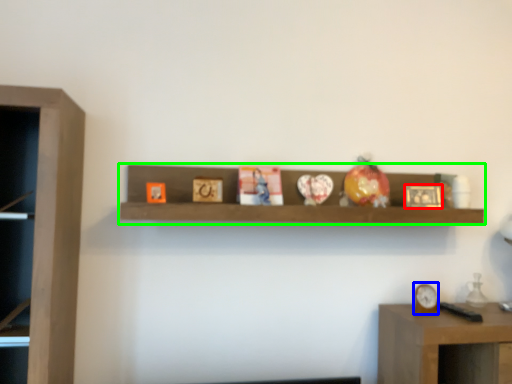
Question: Which object is positioned farthest from picture frame (highlighted by a red box)? Select from clock (highlighted by a blue box) and shelf (highlighted by a green box).

Choices:
 (A) clock
 (B) shelf

Answer: (B)